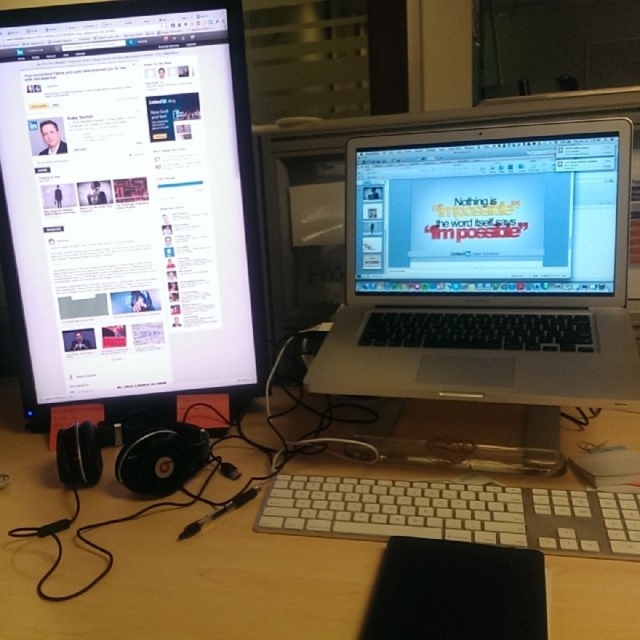
In the scene shown: Does matte black monitor at left have a smaller size compared to wooden desk at center?

Indeed, matte black monitor at left has a smaller size compared to wooden desk at center.

Which is behind, point (44, 349) or point (294, 573)?

The point (44, 349) is more distant.

At what (x,y) coordinates should I click in order to perform the action: click on matte black monitor at left. Please return your answer as a coordinate pair (x, y). The image size is (640, 640). Looking at the image, I should click on (129, 202).

Does silver metallic laptop at center appear on the right side of white plastic keyboard at center?

Yes, silver metallic laptop at center is to the right of white plastic keyboard at center.

Between silver metallic laptop at center and white plastic keyboard at center, which one has more height?

silver metallic laptop at center is taller.

I want to click on silver metallic laptop at center, so click(486, 268).

Can you confirm if silver metallic laptop at center is positioned above wooden desk at center?

Yes.

Does silver metallic laptop at center appear on the right side of wooden desk at center?

Correct, you'll find silver metallic laptop at center to the right of wooden desk at center.

Identify the location of silver metallic laptop at center. Image resolution: width=640 pixels, height=640 pixels. (486, 268).